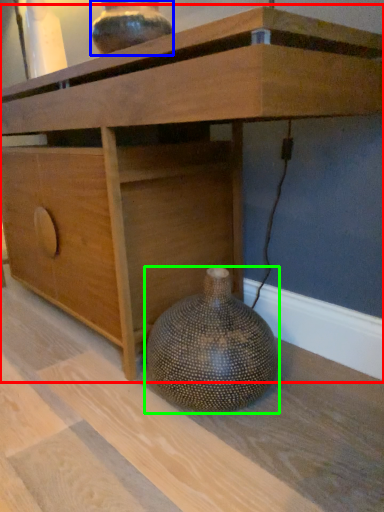
Question: Based on their relative distances, which object is farther from table (highlighted by a red box)? Choose from vase (highlighted by a blue box) and vase (highlighted by a green box).

Choices:
 (A) vase
 (B) vase

Answer: (B)